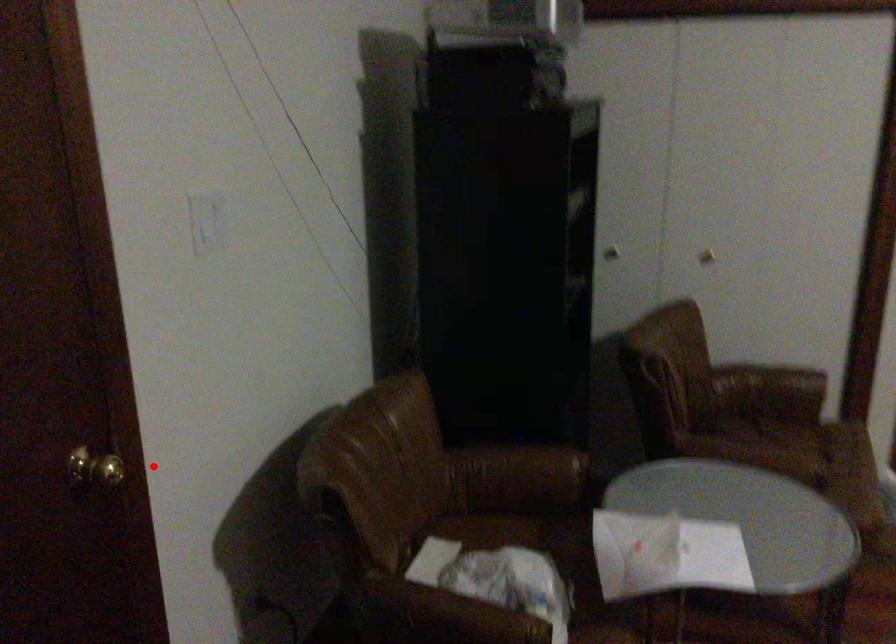
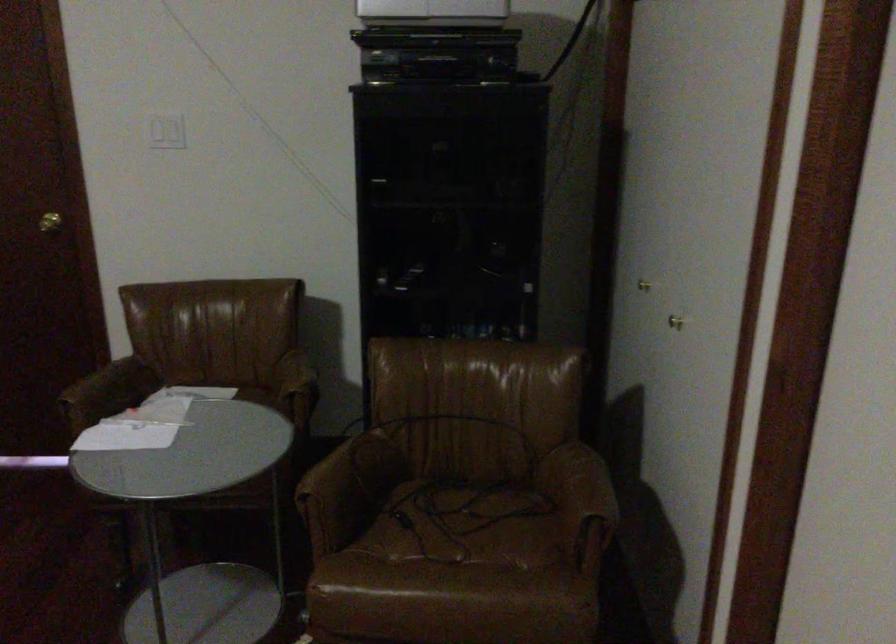
Question: I am providing you with two images of the same scene from different viewpoints. In image1, a red point is highlighted. Considering the same 3D point in image2, which of the following is correct?

Choices:
 (A) It is closer
 (B) It is farther

Answer: (B)